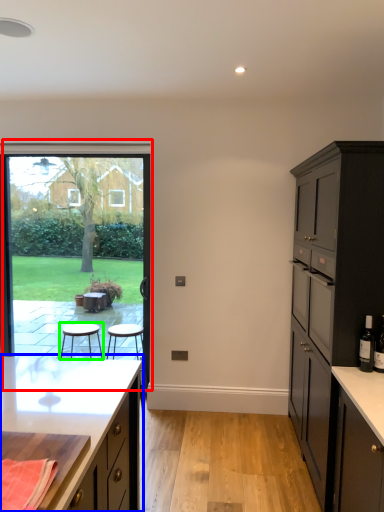
Question: Which object is positioned farthest from window (highlighted by a red box)? Select from cabinetry (highlighted by a blue box) and stool (highlighted by a green box).

Choices:
 (A) cabinetry
 (B) stool

Answer: (A)